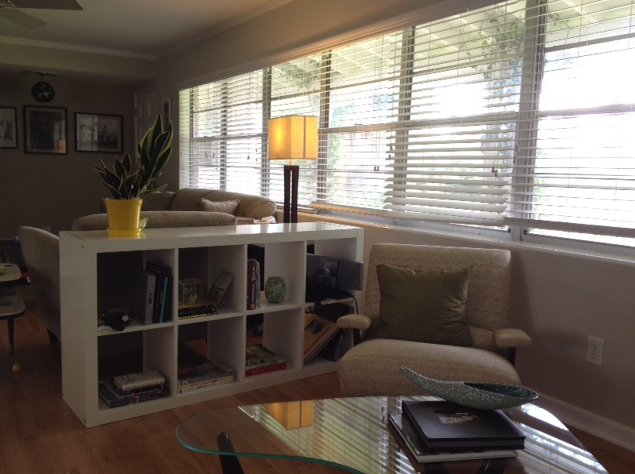
Where is `plant pot`? Image resolution: width=635 pixels, height=474 pixels. plant pot is located at coordinates (123, 219).